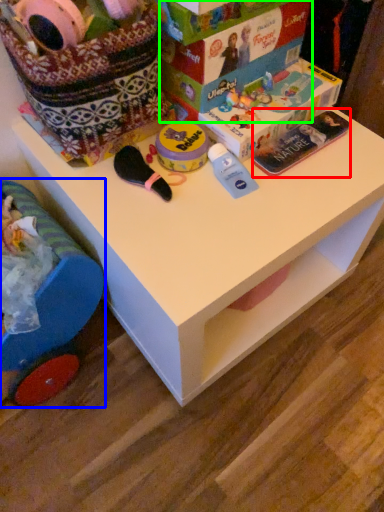
Question: Which object is the farthest from magazine (highlighted by a red box)? Choose among these: toy (highlighted by a blue box) or storage box (highlighted by a green box).

Choices:
 (A) toy
 (B) storage box

Answer: (A)